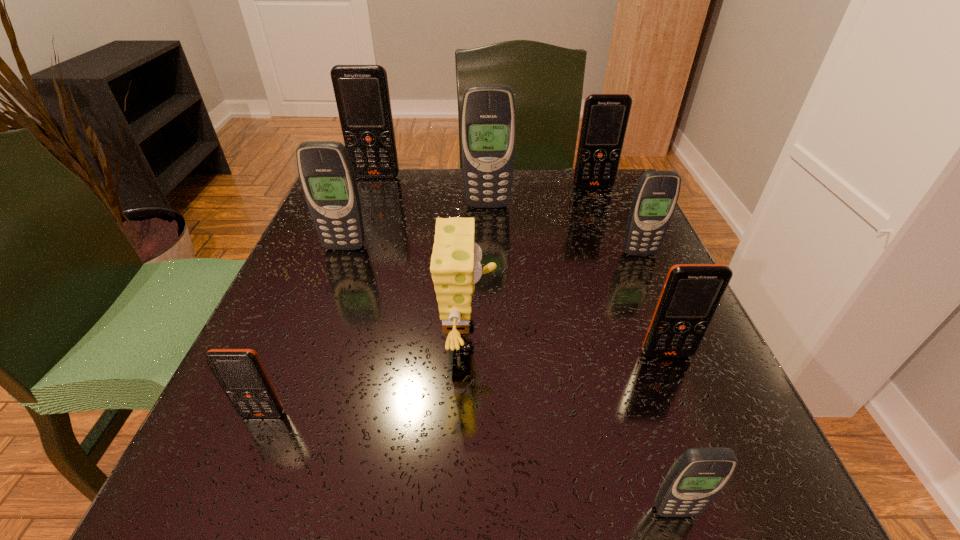
Locate which cellular telephone is the fifth closest to the third nearest cellular telephone. Please provide its 2D coordinates. Your answer should be formatted as a tuple, i.e. [(x, y)], where the tuple contains the x and y coordinates of a point satisfying the conditions above.

[(240, 372)]

You are a GUI agent. You are given a task and a screenshot of the screen. Output one action in this format:
    pyautogui.click(x=<x>, y=<y>)
    Task: Click on the cellular telephone object that ranks as the second closest to the nearest orange cellular telephone
    The image size is (960, 540).
    Given the screenshot: What is the action you would take?
    pyautogui.click(x=698, y=475)

Where is `orange cellular telephone that can be found as the closest to the leftmost gray cellular telephone`? The height and width of the screenshot is (540, 960). orange cellular telephone that can be found as the closest to the leftmost gray cellular telephone is located at coordinates (362, 96).

Point out which orange cellular telephone is positioned as the second nearest to the second gray cellular telephone from right to left. Please provide its 2D coordinates. Your answer should be formatted as a tuple, i.e. [(x, y)], where the tuple contains the x and y coordinates of a point satisfying the conditions above.

[(240, 372)]

At what (x,y) coordinates should I click in order to perform the action: click on the fourth closest gray cellular telephone relative to the second nearest cellular telephone. Please return your answer as a coordinate pair (x, y). Image resolution: width=960 pixels, height=540 pixels. Looking at the image, I should click on (656, 195).

Select which gray cellular telephone is the fourth closest to the second farthest object. Please provide its 2D coordinates. Your answer should be formatted as a tuple, i.e. [(x, y)], where the tuple contains the x and y coordinates of a point satisfying the conditions above.

[(698, 475)]